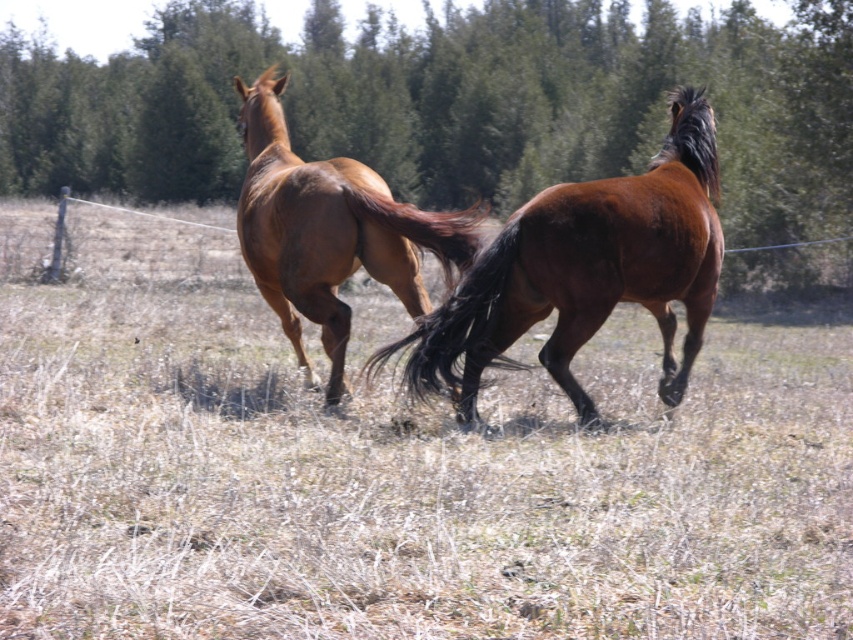
Between brown dry grass at center and shiny brown horse at center, which one appears on the right side from the viewer's perspective?

brown dry grass at center

Can you confirm if brown dry grass at center is wider than shiny brown horse at center?

Yes.

Find the location of a particular element. This screenshot has height=640, width=853. brown dry grass at center is located at coordinates (392, 472).

Is green leafy tree at upper center above black silky tail at center?

Correct, green leafy tree at upper center is located above black silky tail at center.

Is green leafy tree at upper center taller than black silky tail at center?

Indeed, green leafy tree at upper center has a greater height compared to black silky tail at center.

Is point (572, 109) in front of point (428, 364)?

No.

This screenshot has width=853, height=640. I want to click on green leafy tree at upper center, so click(450, 104).

Is brown dry grass at center closer to the viewer compared to black silky tail at center?

Yes, brown dry grass at center is closer to the viewer.

Is point (469, 596) positioned after point (436, 392)?

No, it is in front of (436, 392).

Where is `brown dry grass at center`? brown dry grass at center is located at coordinates (392, 472).

The image size is (853, 640). In order to click on brown dry grass at center in this screenshot , I will do `click(392, 472)`.